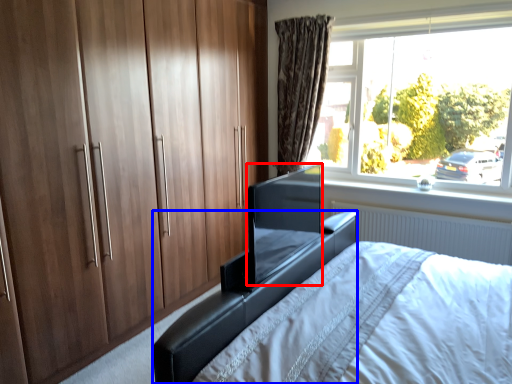
Question: Which object is further to the camera taking this photo, window screen (highlighted by a red box) or bed frame (highlighted by a blue box)?

Choices:
 (A) window screen
 (B) bed frame

Answer: (A)